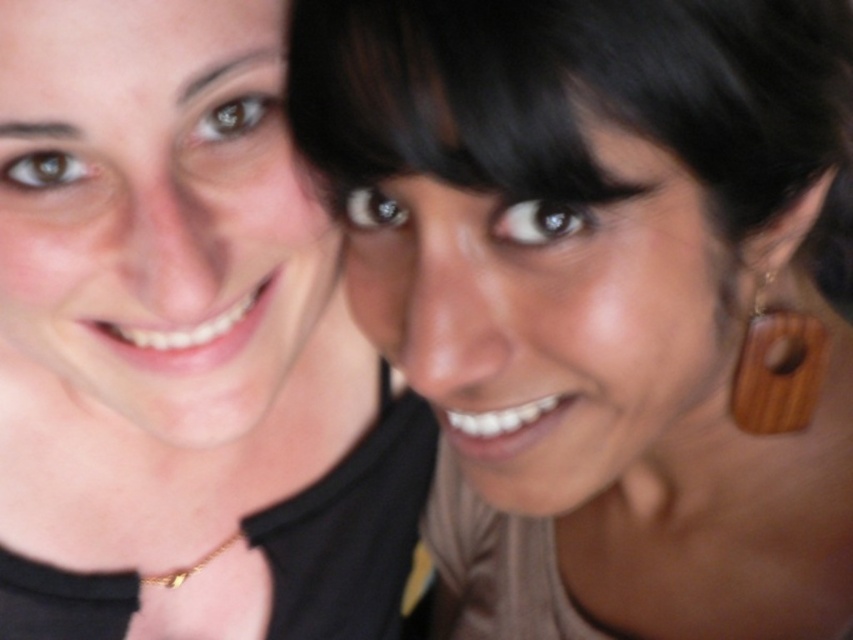
Is wooden pendant at right above gold chain at lower center?

Correct, wooden pendant at right is located above gold chain at lower center.

Is wooden pendant at right shorter than gold chain at lower center?

In fact, wooden pendant at right may be taller than gold chain at lower center.

Who is more forward, (762, 387) or (163, 580)?

Point (762, 387) is more forward.

Find the location of a particular element. The width and height of the screenshot is (853, 640). wooden pendant at right is located at coordinates (776, 369).

Which is below, brown wooden earrings at upper right or gold chain at lower center?

gold chain at lower center is below.

Is point (691, 92) closer to camera compared to point (218, 552)?

That is True.

Is point (294, 48) positioned in front of point (167, 580)?

Yes, it is.

Find the location of a particular element. The image size is (853, 640). brown wooden earrings at upper right is located at coordinates (596, 296).

Is the position of brown wooden earrings at upper right less distant than that of matte black necklace at center?

That is False.

Who is taller, brown wooden earrings at upper right or matte black necklace at center?

brown wooden earrings at upper right is taller.

Is point (552, 134) positioned in front of point (402, 509)?

Yes, it is in front of point (402, 509).

Locate an element on the screen. This screenshot has height=640, width=853. brown wooden earrings at upper right is located at coordinates (596, 296).